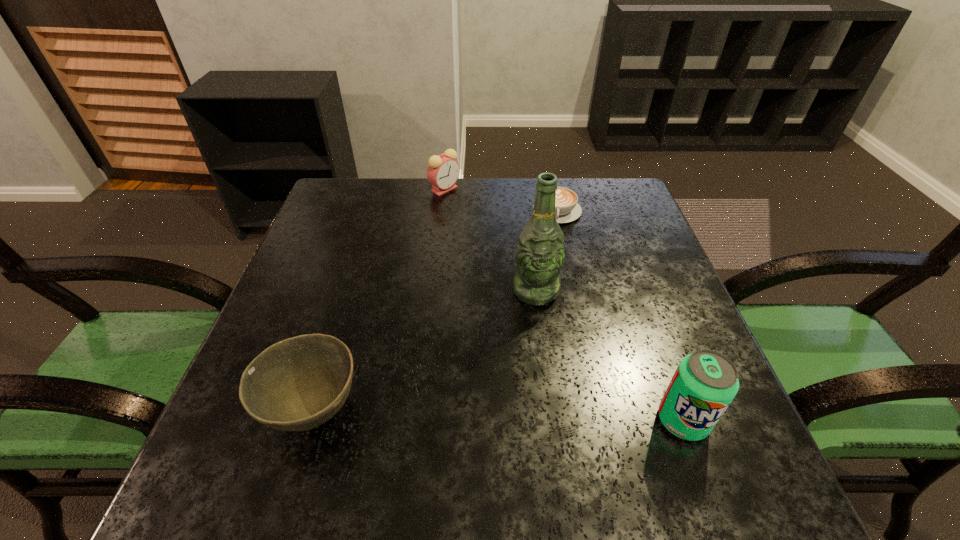
This screenshot has height=540, width=960. In the image, there is a desktop. In order to click on free space at the right edge in this screenshot , I will do `click(626, 278)`.

I want to click on free space at the far left corner of the desktop, so click(378, 200).

Find the location of a particular element. free space at the far right corner of the desktop is located at coordinates (597, 218).

Where is `vacant point located between the fourth shortest object and the fourth nearest object`? vacant point located between the fourth shortest object and the fourth nearest object is located at coordinates (620, 316).

This screenshot has width=960, height=540. In order to click on vacant area between the bowl and the farthest object in this screenshot , I will do 379,300.

Where is `free space between the bowl and the shortest object`? free space between the bowl and the shortest object is located at coordinates (436, 311).

Image resolution: width=960 pixels, height=540 pixels. Identify the location of empty space between the farthest object and the second farthest object. (501, 200).

Identify the location of free space between the cappuccino and the fourth shortest object. This screenshot has width=960, height=540. (620, 316).

The image size is (960, 540). I want to click on vacant area between the leftmost object and the third farthest object, so click(x=425, y=351).

In order to click on unoccupied area between the pop soda and the third nearest object in this screenshot , I will do `click(610, 356)`.